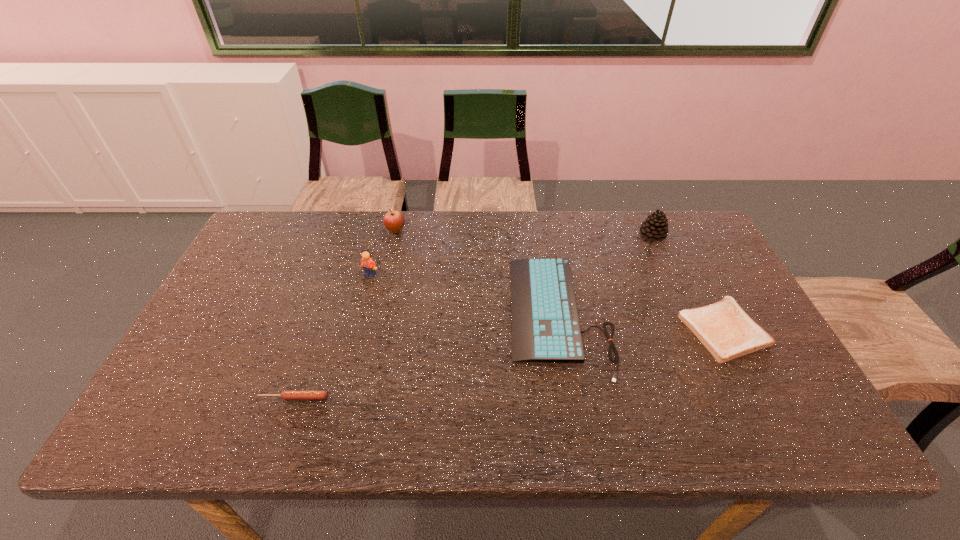
Image resolution: width=960 pixels, height=540 pixels. Find the location of `free space between the nearest object and the computer keyboard`. free space between the nearest object and the computer keyboard is located at coordinates (427, 356).

The image size is (960, 540). In order to click on unoccupied area between the third object from right to left and the toast in this screenshot , I will do `click(642, 322)`.

Locate an element on the screen. free point between the Lego and the computer keyboard is located at coordinates (466, 294).

This screenshot has width=960, height=540. I want to click on vacant space in between the apple and the fourth tallest object, so click(x=478, y=273).

The width and height of the screenshot is (960, 540). Find the location of `free space between the second shortest object and the apple`. free space between the second shortest object and the apple is located at coordinates (345, 314).

Locate which object is the closest to the pinecone. Please provide its 2D coordinates. Your answer should be formatted as a tuple, i.e. [(x, y)], where the tuple contains the x and y coordinates of a point satisfying the conditions above.

[(545, 326)]

Locate an element on the screen. This screenshot has width=960, height=540. the third closest object to the computer keyboard is located at coordinates (394, 221).

This screenshot has height=540, width=960. Identify the location of free space that satisfies the following two spatial constraints: 1. on the front-facing side of the computer keyboard; 2. on the right side of the Lego. (360, 315).

I want to click on vacant space that satisfies the following two spatial constraints: 1. at the narrow end of the pinecone; 2. on the front side of the fourth tallest object, so click(x=687, y=315).